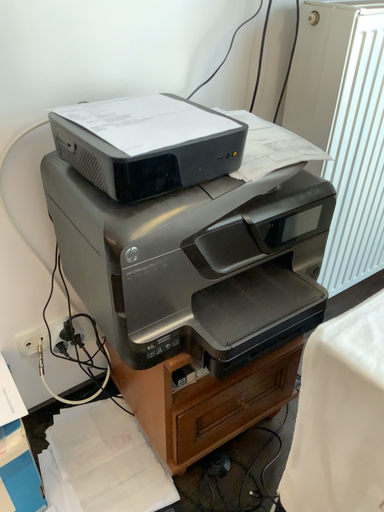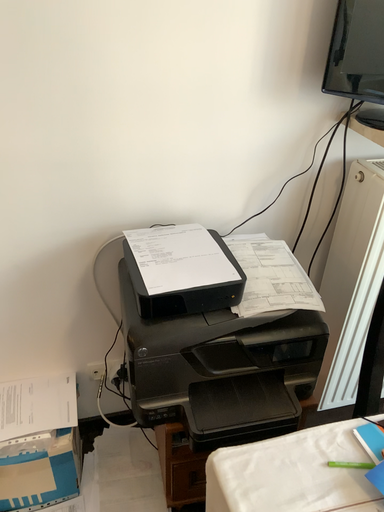
Question: How did the camera likely rotate when shooting the video?

Choices:
 (A) rotated left
 (B) rotated right

Answer: (A)